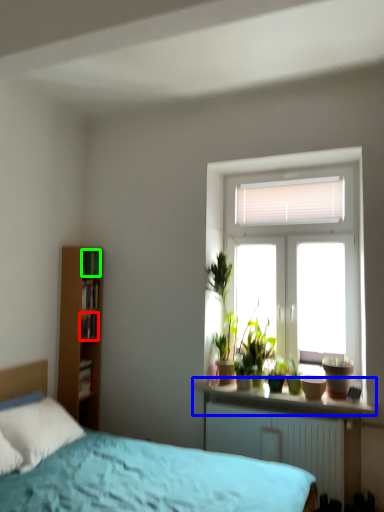
Question: Estimate the real-world distances between objects in this image. Which object is closer to book (highlighted by a red box), window sill (highlighted by a blue box) or book (highlighted by a green box)?

Choices:
 (A) window sill
 (B) book

Answer: (B)